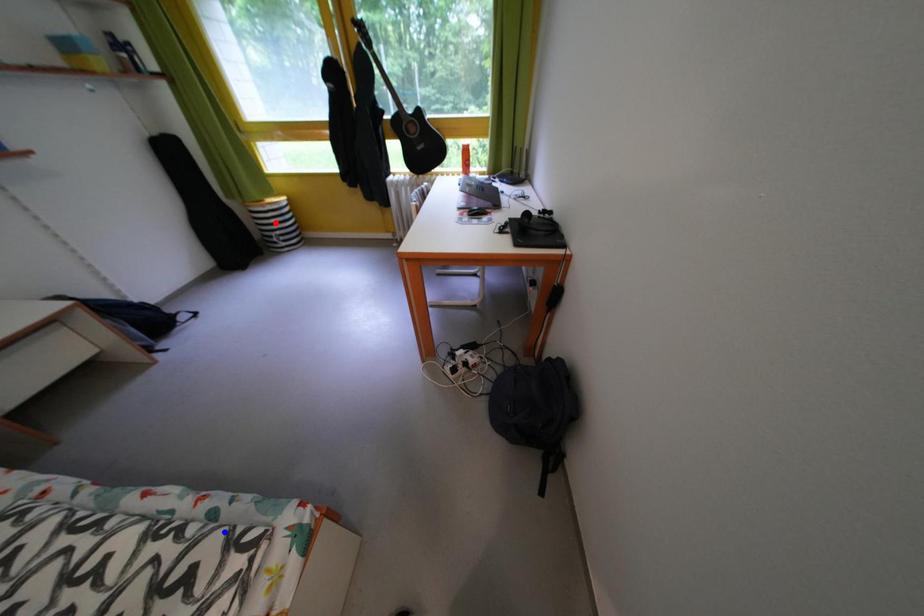
Question: Which of the two points in the image is closer to the camera?

Choices:
 (A) Blue point is closer.
 (B) Red point is closer.

Answer: (A)